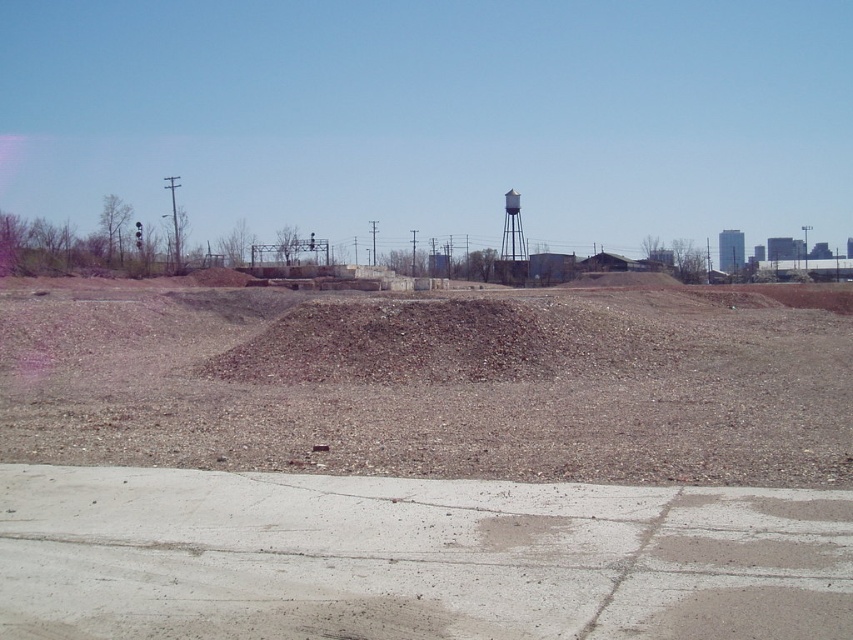
You are standing at the cracked concrete pavement in the foreground of the construction site. You see two points marked on the ground, point (529,308) and point (521,260). Which point is closer to you?

Point (529,308) is closer to the viewer than point (521,260).

Based on the photo, you are a construction worker who needs to transport materials from the brown gravel at center to the white painted metal water tower at upper center. Which object has a larger width that you need to consider for equipment planning?

The brown gravel at center has a larger width than the white painted metal water tower at upper center according to the description, so you should consider the brown gravel at center when planning equipment dimensions.

You are standing at the point marked by point (434, 390) in the image. Looking around, you see brown gravel at center. What is directly under your feet?

The point (434, 390) marks the brown gravel at center, so you are standing directly on the brown gravel at center.